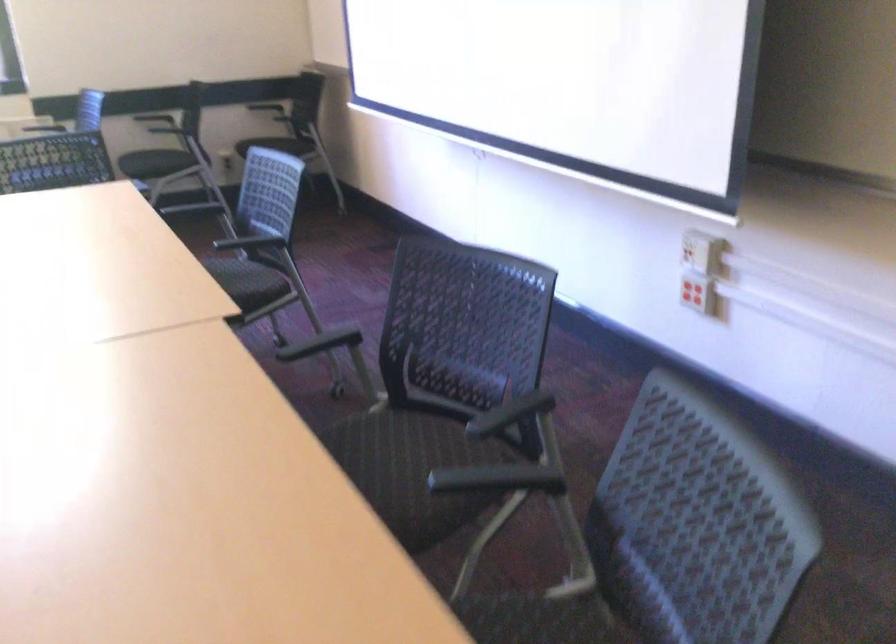
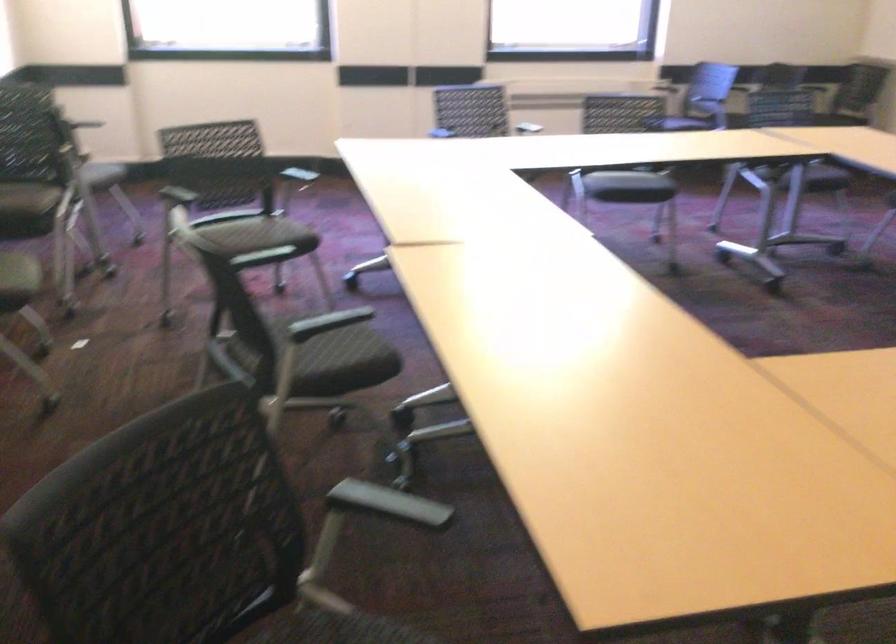
The images are taken continuously from a first-person perspective. In which direction are you moving?

The cameraman moved toward left, backward.